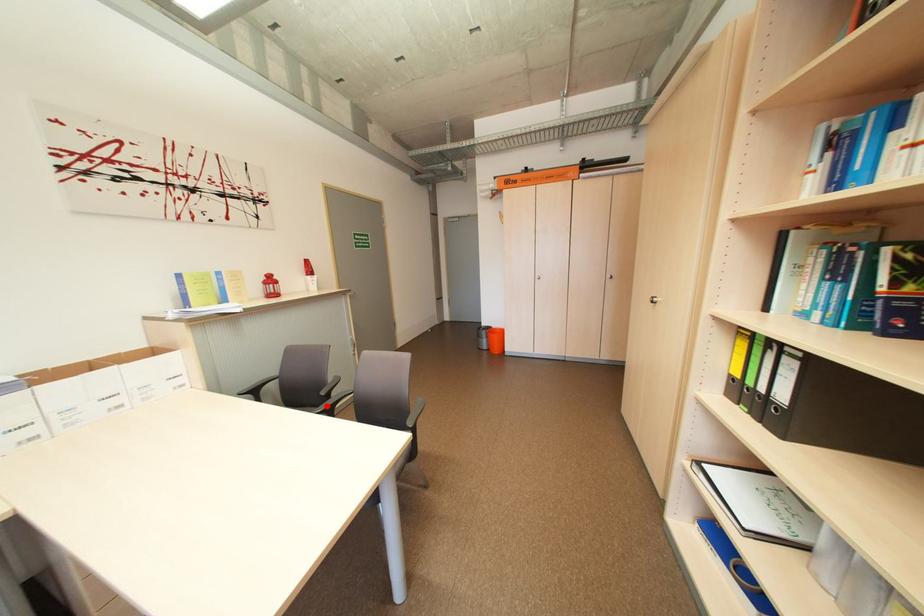
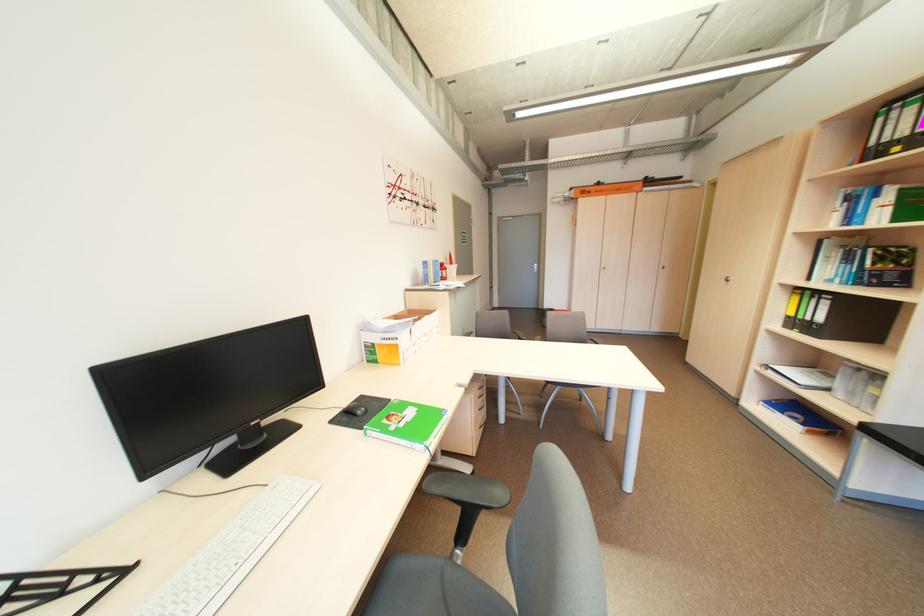
Question: I am providing you with two images of the same scene from different viewpoints. A red point is marked on the first image. At the location where the point appears in image 1, is it still visible in image 2?

Choices:
 (A) Yes
 (B) No

Answer: (B)